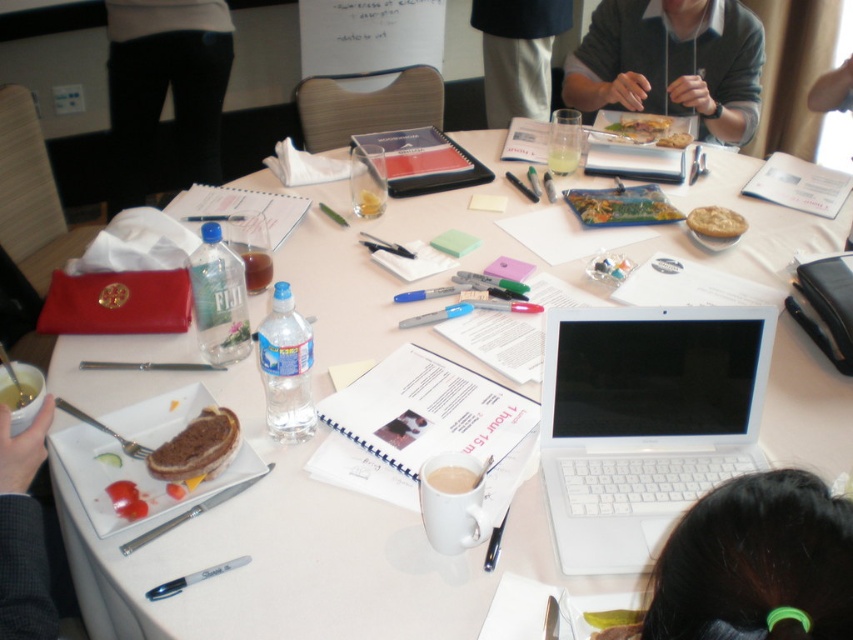
You are sitting at the large white table and need to reach for something. There is a black hair at lower right. Where exactly is the black hair located on the table?

The black hair at lower right is located at the coordinates point (756,563) on the table.

You are organizing a clothing donation drive and need to sort items by size. You find a black pants at center and a dark gray sweater at upper right. Which item should you place in the large size bin?

The black pants at center is larger in size than the dark gray sweater at upper right, so you should place the black pants at center in the large size bin.